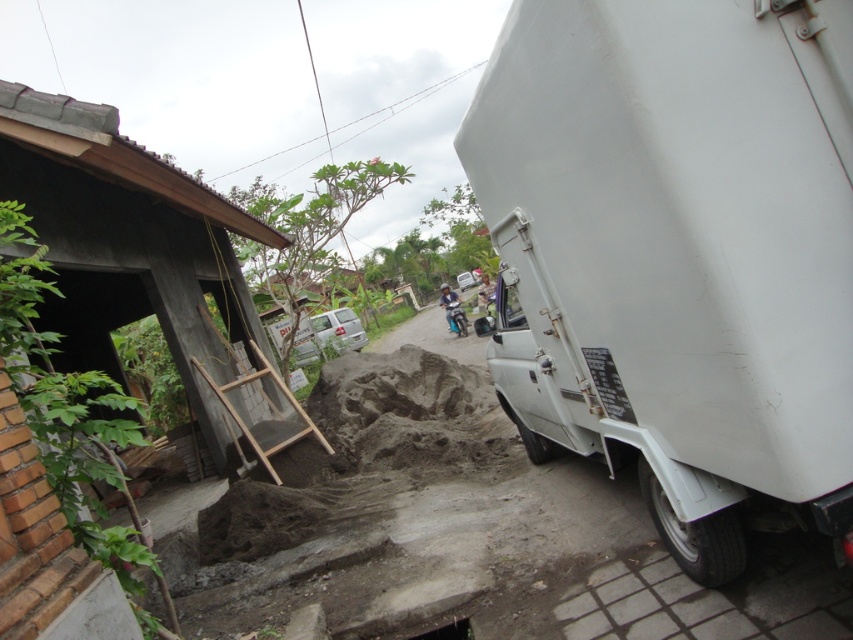
You are a delivery person who needs to park your truck next to the smooth concrete hut at left without blocking the driveway. The driveway is directly behind the white matte truck at right. Can you safely park your truck there?

The white matte truck at right might be wider than the smooth concrete hut at left, so parking your truck next to the smooth concrete hut at left could potentially block the driveway if the truck is wider. Check the width before parking.

You are a delivery person who needs to park your white matte truck at right as close as possible to the wooden ladder at lower left without blocking the ladder. Given their height difference, which object should be positioned lower to allow this?

The white matte truck at right is much taller than the wooden ladder at lower left. To park the truck close to the ladder without blocking it, the truck should be positioned lower so that its height does not obstruct the ladder.

You are a delivery person who needs to park your vehicle in the space between the white matte truck at right and the smooth concrete hut at left. The parking space is only 5 meters wide. Can you fit your vehicle if it is 3 meters wide?

The white matte truck at right is bigger than the smooth concrete hut at left, but the exact distance between them isn not provided. Without knowing the actual space between the two objects, it is impossible to determine if the 3 meter wide vehicle will fit.